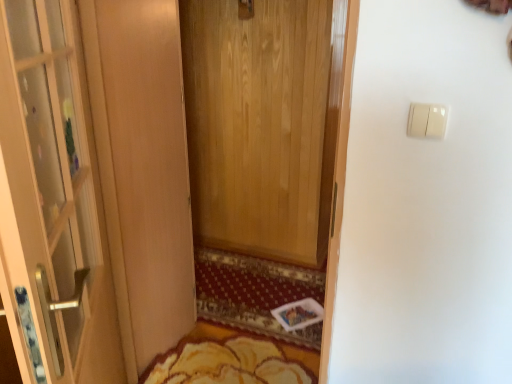
Question: Is white plastic light switch at upper right at the back of yellow textured rug at center?

Choices:
 (A) no
 (B) yes

Answer: (A)

Question: Considering the relative positions of yellow textured rug at center and white plastic light switch at upper right in the image provided, is yellow textured rug at center to the right of white plastic light switch at upper right from the viewer's perspective?

Choices:
 (A) no
 (B) yes

Answer: (A)

Question: Is yellow textured rug at center next to white plastic light switch at upper right and touching it?

Choices:
 (A) no
 (B) yes

Answer: (A)

Question: Considering the relative sizes of yellow textured rug at center and white plastic light switch at upper right in the image provided, is yellow textured rug at center bigger than white plastic light switch at upper right?

Choices:
 (A) no
 (B) yes

Answer: (B)

Question: Is yellow textured rug at center smaller than white plastic light switch at upper right?

Choices:
 (A) no
 (B) yes

Answer: (A)

Question: Considering the relative positions of white plastic light switch at upper right and yellow textured rug at center in the image provided, is white plastic light switch at upper right to the left or to the right of yellow textured rug at center?

Choices:
 (A) left
 (B) right

Answer: (B)

Question: Considering the positions of white plastic light switch at upper right and yellow textured rug at center in the image, is white plastic light switch at upper right wider or thinner than yellow textured rug at center?

Choices:
 (A) wide
 (B) thin

Answer: (B)

Question: Is point (410, 105) closer or farther from the camera than point (223, 314)?

Choices:
 (A) closer
 (B) farther

Answer: (A)

Question: In the image, is white plastic light switch at upper right positioned in front of or behind yellow textured rug at center?

Choices:
 (A) front
 (B) behind

Answer: (A)

Question: Does point (83, 220) appear closer or farther from the camera than point (246, 306)?

Choices:
 (A) closer
 (B) farther

Answer: (A)

Question: From the image's perspective, is matte glass door at left positioned above or below yellow textured rug at center?

Choices:
 (A) above
 (B) below

Answer: (A)

Question: Considering the positions of matte glass door at left and yellow textured rug at center in the image, is matte glass door at left taller or shorter than yellow textured rug at center?

Choices:
 (A) short
 (B) tall

Answer: (B)

Question: Is matte glass door at left in front of or behind yellow textured rug at center in the image?

Choices:
 (A) behind
 (B) front

Answer: (B)

Question: Looking at the image, does yellow floral rug at lower center seem bigger or smaller compared to white plastic light switch at upper right?

Choices:
 (A) big
 (B) small

Answer: (A)

Question: Is point (190, 342) closer or farther from the camera than point (439, 137)?

Choices:
 (A) closer
 (B) farther

Answer: (B)